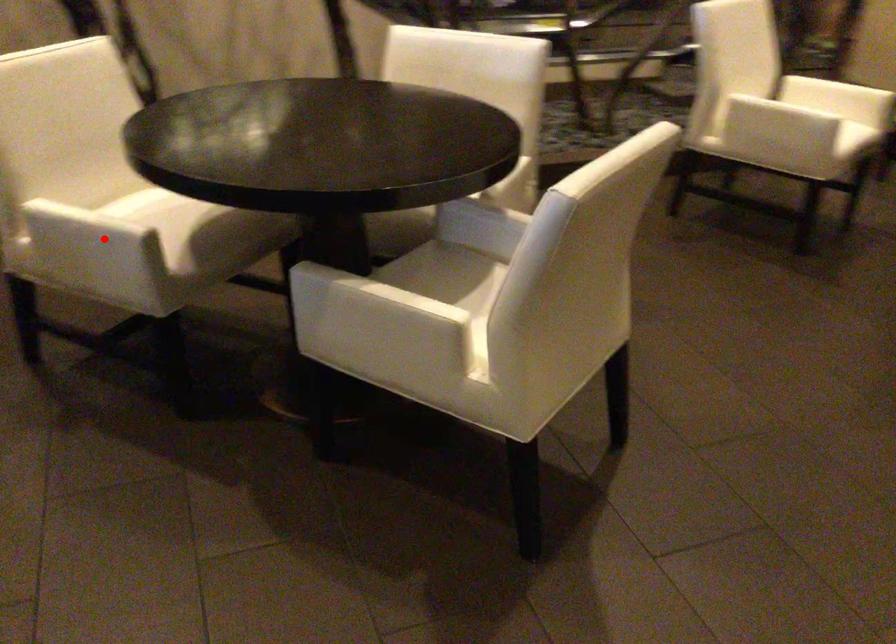
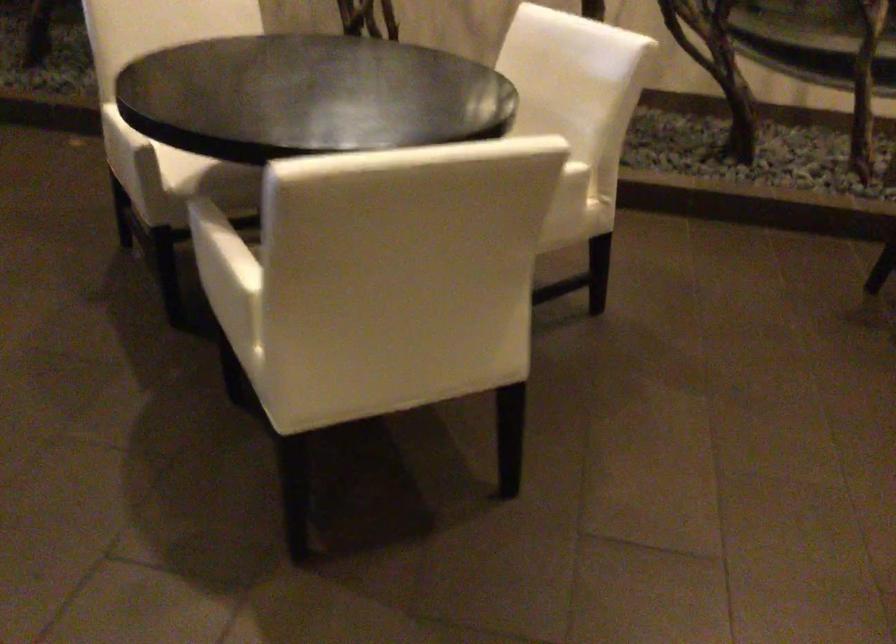
Question: A red point is marked in image1. In image2, is the corresponding 3D point closer to the camera or farther? Reply with the corresponding letter.

Choices:
 (A) The corresponding 3D point is closer.
 (B) The corresponding 3D point is farther.

Answer: (B)